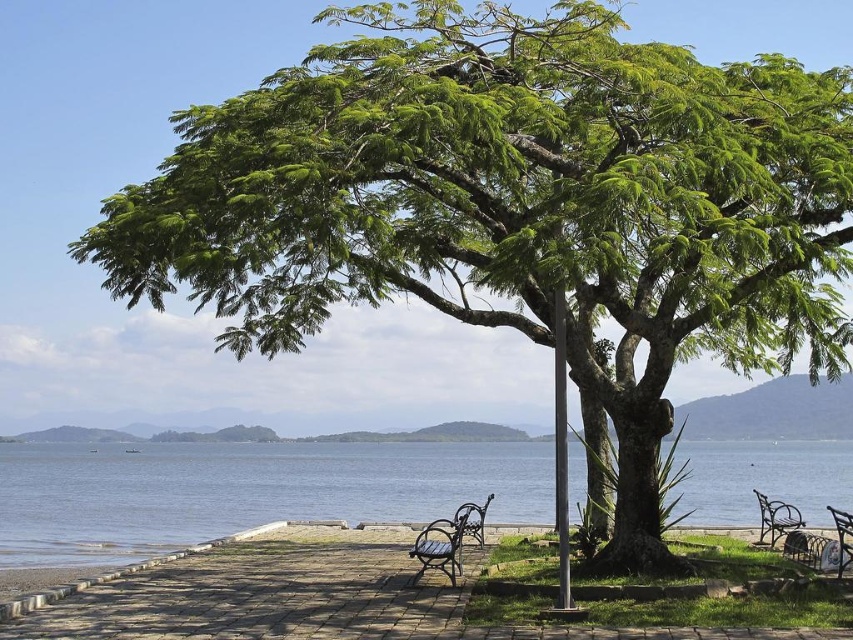
Question: Is blue water at lower center further to the viewer compared to brown wooden bench at lower right?

Choices:
 (A) yes
 (B) no

Answer: (B)

Question: Can you confirm if blue water at lower center is positioned to the left of brown wooden bench at lower right?

Choices:
 (A) yes
 (B) no

Answer: (A)

Question: Estimate the real-world distances between objects in this image. Which object is farther from the brown wooden bench at lower right?

Choices:
 (A) blue water at lower center
 (B) bronze textured bench at center
 (C) wooden bench at center

Answer: (A)

Question: Which point is farther to the camera?

Choices:
 (A) brown wooden bench at lower right
 (B) bronze textured bench at center
 (C) blue water at lower center
 (D) wooden bench at center

Answer: (A)

Question: Can you confirm if bronze textured bench at center is bigger than wooden bench at center?

Choices:
 (A) no
 (B) yes

Answer: (A)

Question: Estimate the real-world distances between objects in this image. Which object is farther from the brown wooden bench at lower right?

Choices:
 (A) wooden bench at center
 (B) bronze textured bench at center
 (C) blue water at lower center

Answer: (C)